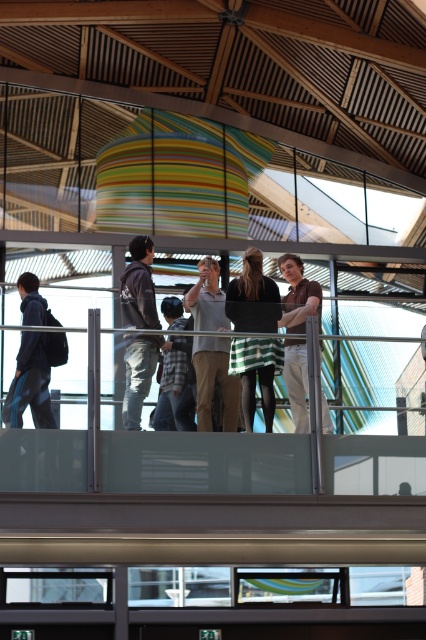
Question: Which point is closer to the camera?

Choices:
 (A) dark gray hoodie at center
 (B) brown cotton shirt at center
 (C) light gray cotton shirt at center

Answer: (A)

Question: Can you confirm if matte black backpack at left is bigger than brown cotton shirt at center?

Choices:
 (A) no
 (B) yes

Answer: (A)

Question: Which object is the closest to the green striped dress at center?

Choices:
 (A) matte black backpack at left
 (B) plaid shirt at center
 (C) light gray cotton shirt at center
 (D) brown cotton shirt at center

Answer: (C)

Question: Where is light gray cotton shirt at center located in relation to plaid shirt at center in the image?

Choices:
 (A) right
 (B) left

Answer: (A)

Question: Can you confirm if green striped dress at center is thinner than light gray cotton shirt at center?

Choices:
 (A) no
 (B) yes

Answer: (A)

Question: Considering the real-world distances, which object is farthest from the plaid shirt at center?

Choices:
 (A) brown cotton shirt at center
 (B) matte black backpack at left
 (C) light gray cotton shirt at center
 (D) green striped dress at center

Answer: (A)